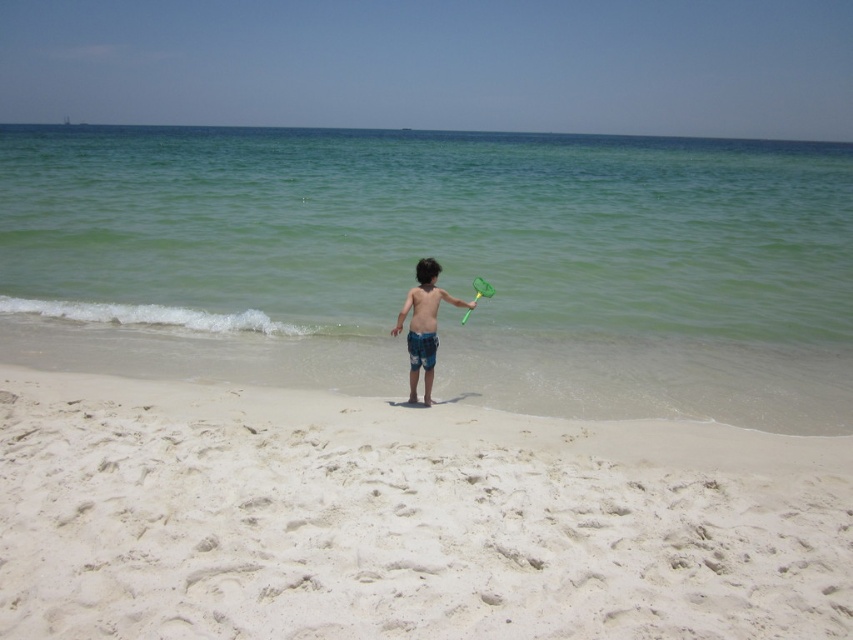
Does white sandy beach at center appear on the left side of green plastic paddle at center?

Indeed, white sandy beach at center is positioned on the left side of green plastic paddle at center.

Which of these two, white sandy beach at center or green plastic paddle at center, stands taller?

green plastic paddle at center is taller.

What do you see at coordinates (404, 518) in the screenshot? The height and width of the screenshot is (640, 853). I see `white sandy beach at center` at bounding box center [404, 518].

Locate an element on the screen. white sandy beach at center is located at coordinates (404, 518).

Is point (120, 301) farther from viewer compared to point (415, 296)?

Yes, it is behind point (415, 296).

Is clear water at center further to the viewer compared to blue denim shorts at center?

Yes, clear water at center is behind blue denim shorts at center.

Find the location of a particular element. The height and width of the screenshot is (640, 853). clear water at center is located at coordinates (428, 228).

Can you confirm if white sandy beach at center is taller than blue denim shorts at center?

In fact, white sandy beach at center may be shorter than blue denim shorts at center.

The width and height of the screenshot is (853, 640). What do you see at coordinates (404, 518) in the screenshot? I see `white sandy beach at center` at bounding box center [404, 518].

Between point (711, 540) and point (430, 324), which one is positioned in front?

Point (711, 540) is in front.

Find the location of a particular element. Image resolution: width=853 pixels, height=640 pixels. white sandy beach at center is located at coordinates (404, 518).